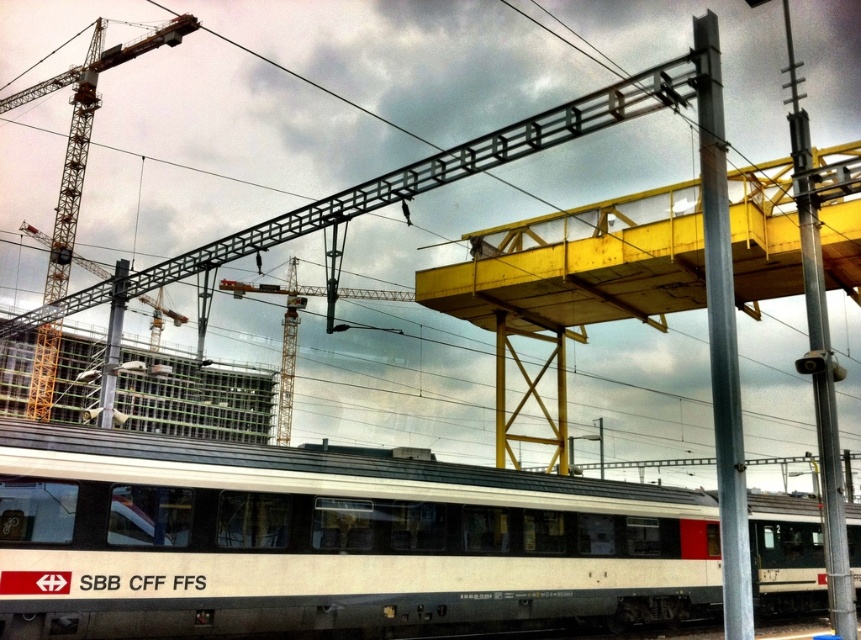
Question: Which point is farther from the camera taking this photo?

Choices:
 (A) (767, 524)
 (B) (710, 188)
 (C) (821, 337)

Answer: (A)

Question: Which object appears farthest from the camera in this image?

Choices:
 (A) metallic gray pole at right
 (B) metallic yellow crane at upper left

Answer: (B)

Question: Does metallic gray pole at right have a larger size compared to metallic yellow crane at upper left?

Choices:
 (A) no
 (B) yes

Answer: (B)

Question: Is white matte passenger train at center closer to camera compared to metallic yellow crane at upper left?

Choices:
 (A) yes
 (B) no

Answer: (A)

Question: Does metallic gray pole at center have a smaller size compared to metallic gray pole at right?

Choices:
 (A) yes
 (B) no

Answer: (A)

Question: Which object is closer to the camera taking this photo?

Choices:
 (A) metallic gray pole at center
 (B) white matte passenger train at center
 (C) metallic gray pole at right

Answer: (B)